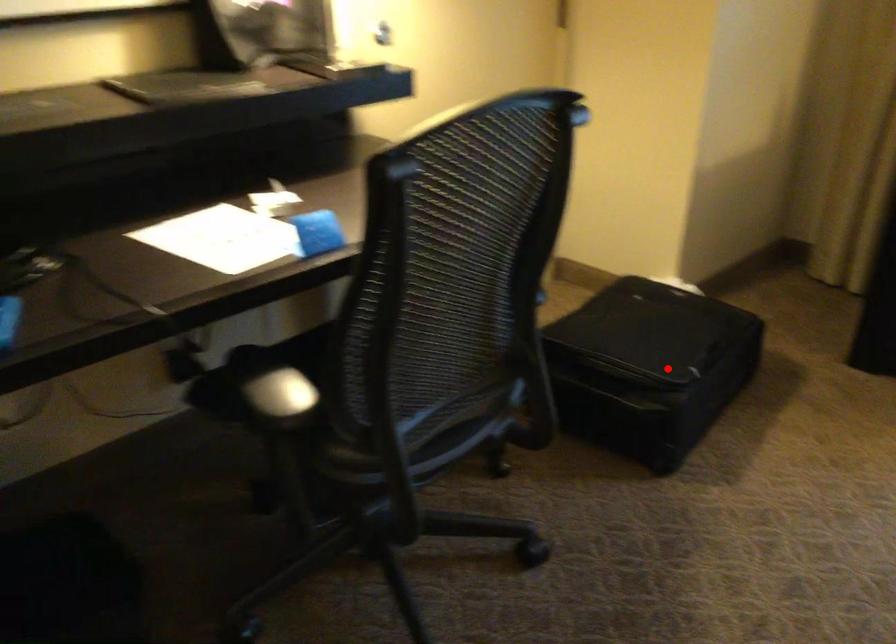
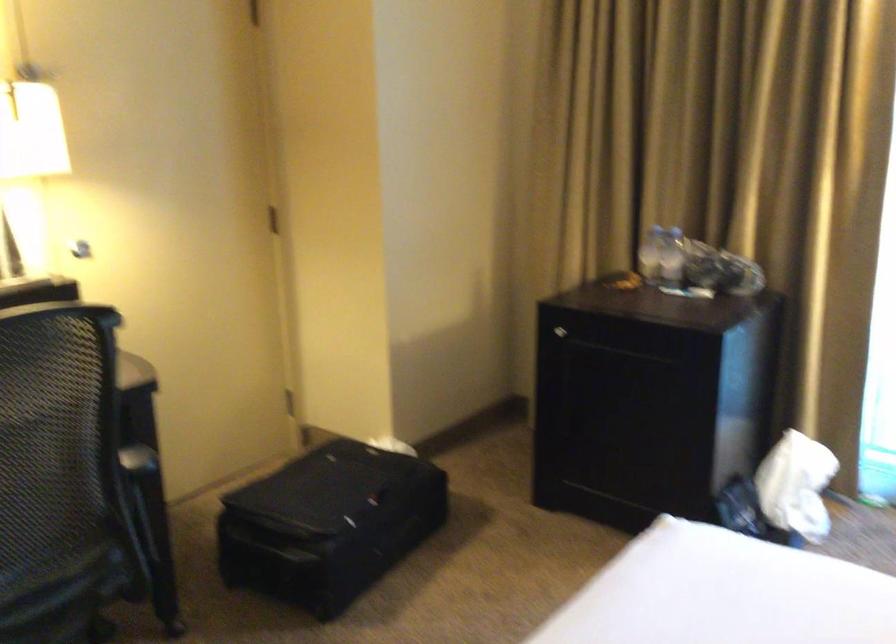
Locate, in the second image, the point that corresponds to the highlighted location in the first image.

(328, 524)